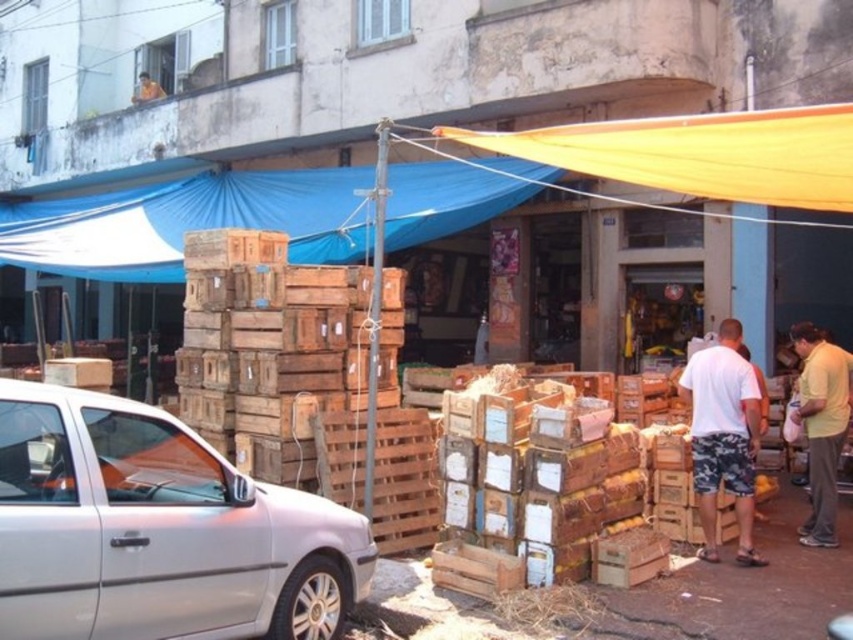
Question: Which object is the farthest from the blue fabric canopy at upper center?

Choices:
 (A) white cotton t-shirt at right
 (B) silver metallic car at lower left
 (C) yellow cotton shirt at right

Answer: (C)

Question: Which of the following is the farthest from the observer?

Choices:
 (A) silver metallic car at lower left
 (B) blue fabric canopy at upper center

Answer: (B)

Question: Is blue fabric canopy at upper center above yellow fabric canopy at upper center?

Choices:
 (A) no
 (B) yes

Answer: (B)

Question: Which point is farther to the camera?

Choices:
 (A) (251, 589)
 (B) (840, 160)
 (C) (737, 420)

Answer: (C)

Question: Is silver metallic car at lower left positioned behind yellow fabric canopy at upper center?

Choices:
 (A) no
 (B) yes

Answer: (A)

Question: Can you confirm if blue fabric canopy at upper center is positioned below white cotton t-shirt at right?

Choices:
 (A) yes
 (B) no

Answer: (B)